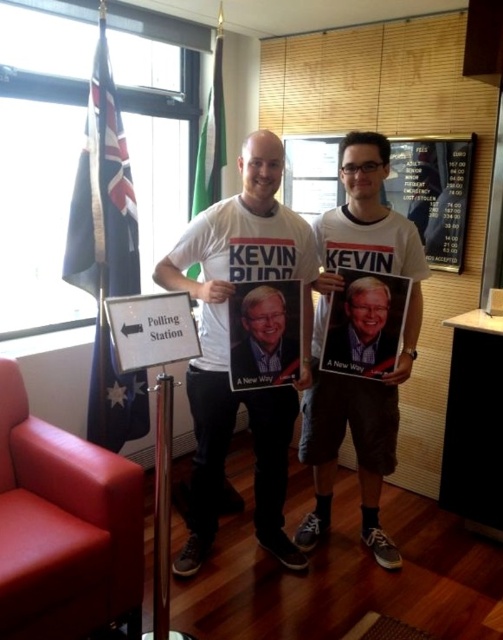
You are standing at the polling station and see two points marked on the floor. The first point is labeled as point (337, 371) and the second is labeled as point (122, 349). According to the image, which point is located behind the other?

Point (337, 371) is behind point (122, 349).